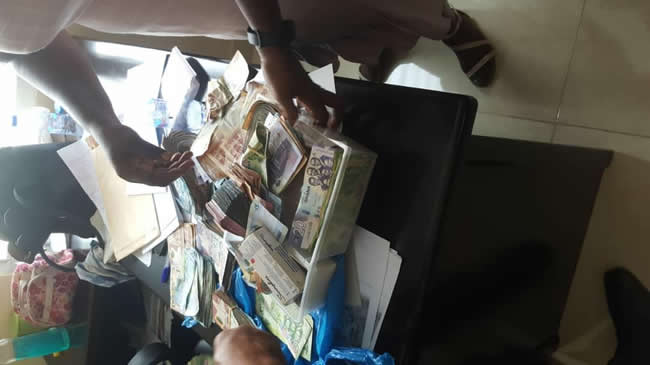
Find the location of `tile`. tile is located at coordinates (624, 150).